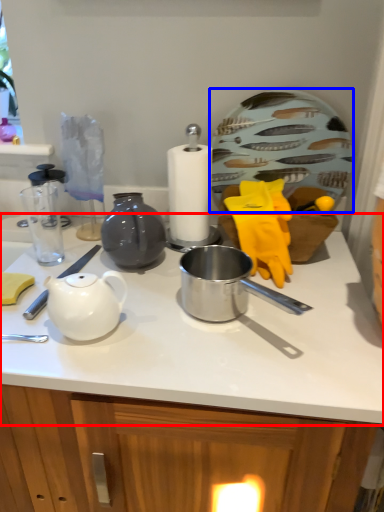
Question: Among these objects, which one is nearest to the camera, countertop (highlighted by a red box) or plate (highlighted by a blue box)?

Choices:
 (A) countertop
 (B) plate

Answer: (A)